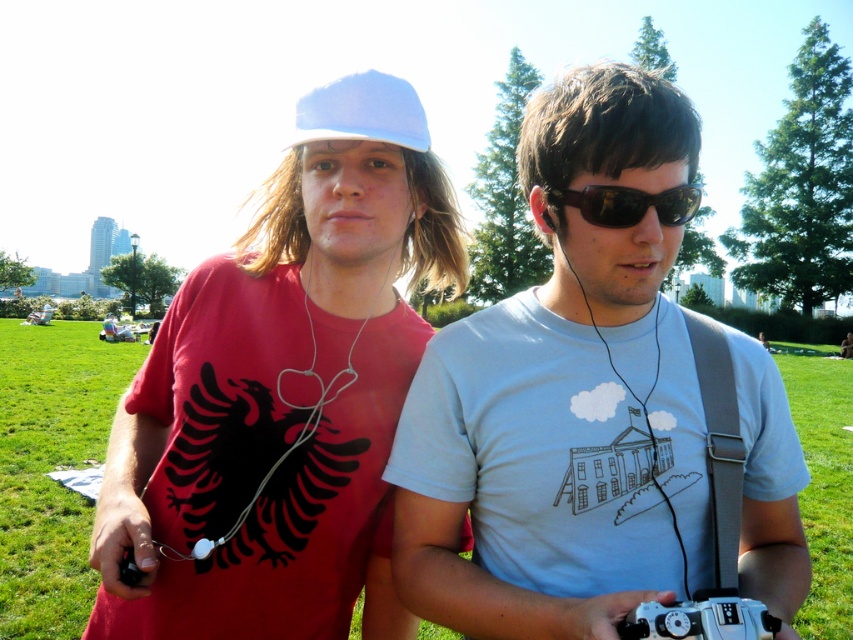
Does matte red t-shirt at center have a greater width compared to light blue fabric baseball cap at upper center?

Indeed, matte red t-shirt at center has a greater width compared to light blue fabric baseball cap at upper center.

Who is lower down, matte red t-shirt at center or light blue fabric baseball cap at upper center?

matte red t-shirt at center

At what (x,y) coordinates should I click in order to perform the action: click on matte red t-shirt at center. Please return your answer as a coordinate pair (x, y). The image size is (853, 640). Looking at the image, I should click on (283, 394).

Can you confirm if white matte t-shirt at center is positioned below light blue fabric baseball cap at upper center?

Yes.

Describe the element at coordinates (566, 397) in the screenshot. I see `white matte t-shirt at center` at that location.

Who is more distant from viewer, (689, 483) or (366, 109)?

Point (366, 109)

Locate an element on the screen. This screenshot has height=640, width=853. white matte t-shirt at center is located at coordinates (566, 397).

Between white matte t-shirt at center and white earphone at center, which one appears on the right side from the viewer's perspective?

From the viewer's perspective, white matte t-shirt at center appears more on the right side.

Is point (770, 532) behind point (409, 220)?

No.

Which is behind, point (581, 474) or point (412, 216)?

Point (412, 216)

Find the location of `white matte t-shirt at center`. white matte t-shirt at center is located at coordinates (566, 397).